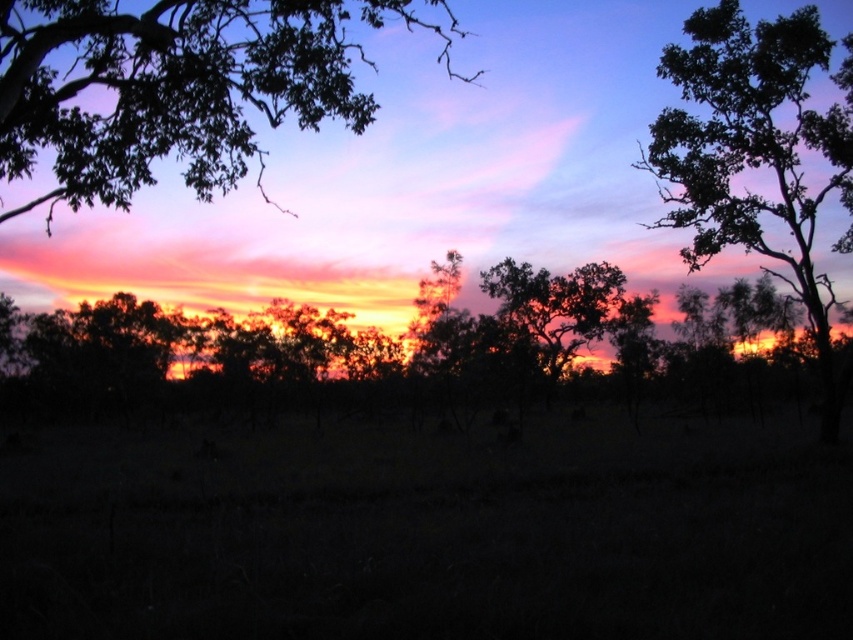
You are an artist trying to paint the sunset scene. You notice two trees in the image, the dark green leafy tree at upper left and the silhouette leafy tree at center. Which tree should you paint first to ensure proper layering in your artwork?

You should paint the dark green leafy tree at upper left first because it is larger than the silhouette leafy tree at center, allowing you to establish the background layer before adding smaller foreground details.

You are an observer standing in the field looking towards the sunset. Which tree, the silhouette tree at center or the dark green leafy tree at upper left, appears taller from your perspective?

The dark green leafy tree at upper left appears taller than the silhouette tree at center from your perspective.

You are planning to set up a small tent between the dark green leafy tree at upper right and the silhouette leafy tree at center. The tent requires a minimum of 15 meters of space between the two trees to be set up safely. Can you determine if there is enough space between them for the tent?

The dark green leafy tree at upper right and the silhouette leafy tree at center are 15.15 meters apart, which is just over the required 15 meters. Therefore, there is enough space to safely set up the tent between them.